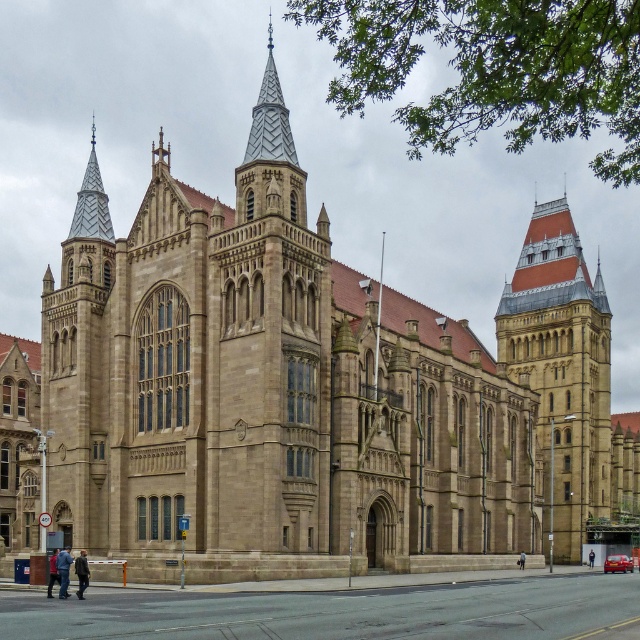
You are an architect assessing the symmetry of the historic building. You notice the brown stone tower at upper right and the silver mosaic spire at upper left. Which of these two structures is wider?

The brown stone tower at upper right is wider than the silver mosaic spire at upper left, as its width surpasses the latter.

In the scene shown: What is located at the coordinates point (561, 371) in the image?

The point (561, 371) is where the brown stone tower at upper right is located.

You are an architect assessing the symmetry of the building. You notice the brown stone tower at upper right and the silver mosaic spire at upper left. Which of these two structures is larger in size?

The brown stone tower at upper right is bigger than the silver mosaic spire at upper left according to the description.